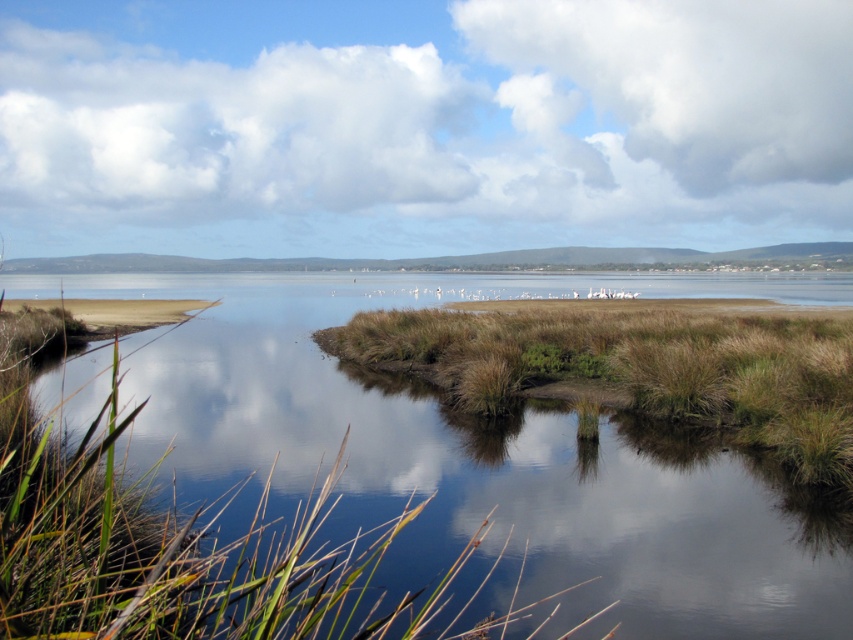
Is green grassy land at center above brown grassy island at center?

Indeed, green grassy land at center is positioned over brown grassy island at center.

Is green grassy land at center in front of brown grassy island at center?

Yes, it is in front of brown grassy island at center.

The image size is (853, 640). Identify the location of green grassy land at center. (485, 458).

This screenshot has width=853, height=640. Identify the location of green grassy land at center. (485, 458).